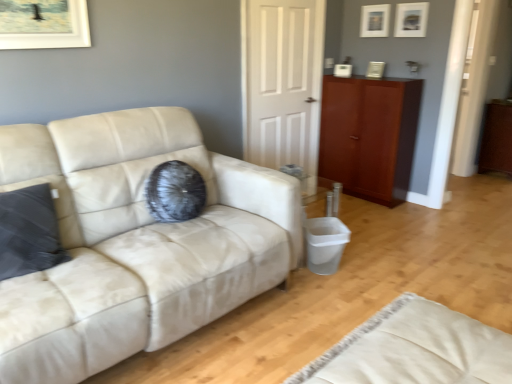
Question: Can you confirm if white matte door at center is thinner than matte white picture frame at upper center, acting as the first picture frame starting from the front?

Choices:
 (A) no
 (B) yes

Answer: (B)

Question: Does white matte door at center come behind matte white picture frame at upper center, acting as the first picture frame starting from the front?

Choices:
 (A) yes
 (B) no

Answer: (B)

Question: Is white matte door at center located outside matte white picture frame at upper center, placed as the second picture frame when sorted from left to right?

Choices:
 (A) no
 (B) yes

Answer: (B)

Question: Is white matte door at center not near matte white picture frame at upper center, the second picture frame in the back-to-front sequence?

Choices:
 (A) no
 (B) yes

Answer: (B)

Question: Is white matte door at center shorter than matte white picture frame at upper center, placed as the second picture frame when sorted from left to right?

Choices:
 (A) no
 (B) yes

Answer: (A)

Question: Looking at their shapes, would you say matte white picture frame at upper right, which is the 2th picture frame from front to back, is wider or thinner than matte white picture frame at upper center, acting as the first picture frame starting from the front?

Choices:
 (A) thin
 (B) wide

Answer: (B)

Question: From a real-world perspective, is matte white picture frame at upper right, which is counted as the first picture frame, starting from the back, physically located above or below matte white picture frame at upper center, acting as the first picture frame starting from the front?

Choices:
 (A) below
 (B) above

Answer: (B)

Question: Which is correct: matte white picture frame at upper right, which is the 2th picture frame from front to back, is inside matte white picture frame at upper center, arranged as the 1th picture frame when viewed from the right, or outside of it?

Choices:
 (A) inside
 (B) outside

Answer: (B)

Question: Does point (368, 6) appear closer or farther from the camera than point (399, 29)?

Choices:
 (A) farther
 (B) closer

Answer: (A)

Question: Does point (394, 28) appear closer or farther from the camera than point (291, 33)?

Choices:
 (A) farther
 (B) closer

Answer: (A)

Question: Considering the positions of matte white picture frame at upper center, arranged as the 1th picture frame when viewed from the right, and white matte door at center in the image, is matte white picture frame at upper center, arranged as the 1th picture frame when viewed from the right, bigger or smaller than white matte door at center?

Choices:
 (A) small
 (B) big

Answer: (A)

Question: From the image's perspective, is matte white picture frame at upper center, arranged as the 1th picture frame when viewed from the right, above or below white matte door at center?

Choices:
 (A) below
 (B) above

Answer: (B)

Question: Is matte white picture frame at upper center, placed as the second picture frame when sorted from left to right, in front of or behind white matte door at center in the image?

Choices:
 (A) front
 (B) behind

Answer: (B)

Question: From the image's perspective, is beige fabric rug at lower right above or below brown wood dresser at right?

Choices:
 (A) below
 (B) above

Answer: (A)

Question: Relative to brown wood dresser at right, is beige fabric rug at lower right in front or behind?

Choices:
 (A) behind
 (B) front

Answer: (B)